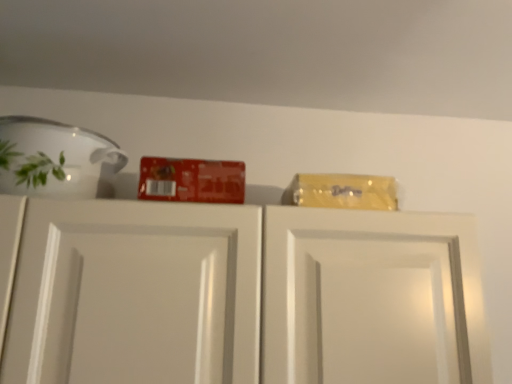
Question: Is white glossy cabinet doors at upper center situated inside white glossy bowl at upper left or outside?

Choices:
 (A) inside
 (B) outside

Answer: (B)

Question: Does point (188, 360) appear closer or farther from the camera than point (113, 168)?

Choices:
 (A) farther
 (B) closer

Answer: (B)

Question: Relative to white glossy bowl at upper left, is white glossy cabinet doors at upper center in front or behind?

Choices:
 (A) front
 (B) behind

Answer: (A)

Question: Would you say white glossy bowl at upper left is inside or outside white glossy cabinet doors at upper center?

Choices:
 (A) outside
 (B) inside

Answer: (A)

Question: In terms of size, does white glossy bowl at upper left appear bigger or smaller than white glossy cabinet doors at upper center?

Choices:
 (A) small
 (B) big

Answer: (A)

Question: Based on their positions, is white glossy bowl at upper left located to the left or right of white glossy cabinet doors at upper center?

Choices:
 (A) left
 (B) right

Answer: (A)

Question: Considering the positions of white glossy bowl at upper left and white glossy cabinet doors at upper center in the image, is white glossy bowl at upper left wider or thinner than white glossy cabinet doors at upper center?

Choices:
 (A) thin
 (B) wide

Answer: (A)